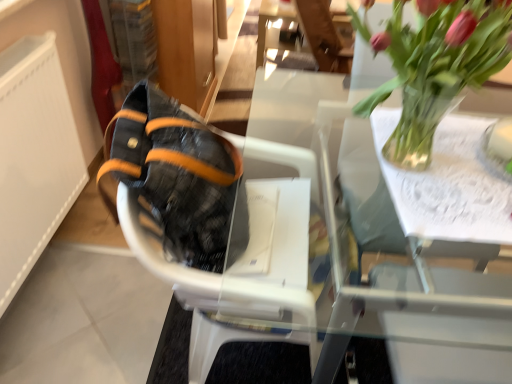
Question: Is white textured radiator at left wider or thinner than transparent glass table at upper center?

Choices:
 (A) thin
 (B) wide

Answer: (A)

Question: From a real-world perspective, is white textured radiator at left positioned above or below transparent glass table at upper center?

Choices:
 (A) above
 (B) below

Answer: (A)

Question: Which is farther from the white textured radiator at left?

Choices:
 (A) leather-like black shoe at left
 (B) transparent glass table at upper center
 (C) translucent glass vase at upper right
 (D) black textured fabric baby carriage at center

Answer: (C)

Question: Which object is the closest to the black textured fabric baby carriage at center?

Choices:
 (A) leather-like black shoe at left
 (B) translucent glass vase at upper right
 (C) transparent glass table at upper center
 (D) white textured radiator at left

Answer: (A)